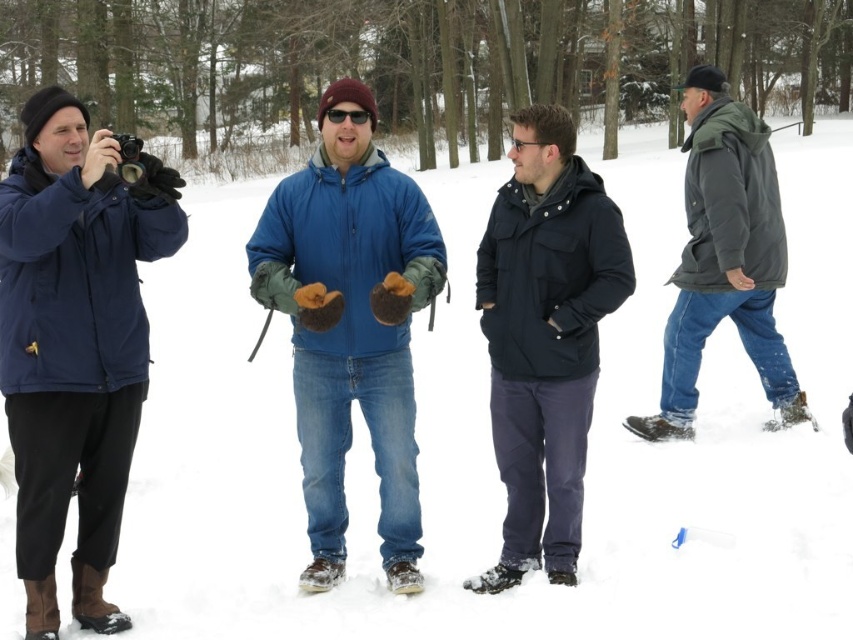
Does blue fleece jacket at center have a greater width compared to dark green puffy jacket at right?

Incorrect, blue fleece jacket at center's width does not surpass dark green puffy jacket at right's.

Can you confirm if blue fleece jacket at center is positioned above dark green puffy jacket at right?

Incorrect, blue fleece jacket at center is not positioned above dark green puffy jacket at right.

Between point (378, 176) and point (682, 314), which one is positioned behind?

The point (682, 314) is behind.

Where is `blue fleece jacket at center`? blue fleece jacket at center is located at coordinates (351, 324).

Does blue fleece jacket at center appear on the right side of dark blue matte jacket at center?

Incorrect, blue fleece jacket at center is not on the right side of dark blue matte jacket at center.

From the picture: Measure the distance between blue fleece jacket at center and camera.

15.44 feet

Identify the location of blue fleece jacket at center. (351, 324).

Consider the image. Can you confirm if navy blue jacket at left is positioned to the right of blue fleece jacket at center?

In fact, navy blue jacket at left is to the left of blue fleece jacket at center.

Can you confirm if navy blue jacket at left is wider than blue fleece jacket at center?

Yes, navy blue jacket at left is wider than blue fleece jacket at center.

Where is `navy blue jacket at left`? This screenshot has height=640, width=853. navy blue jacket at left is located at coordinates (74, 342).